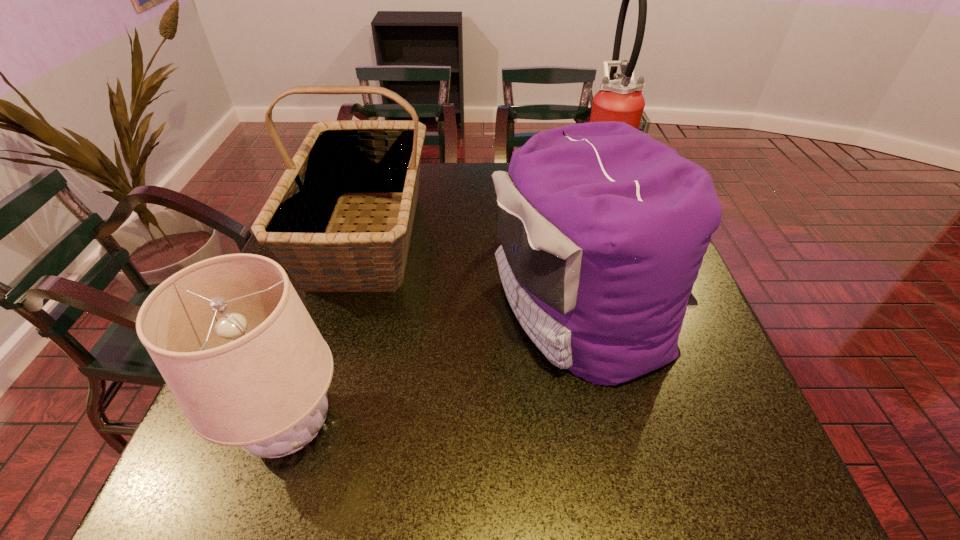
Where is `fire extinguisher`? This screenshot has height=540, width=960. fire extinguisher is located at coordinates (621, 100).

I want to click on basket, so click(338, 159).

Locate an element on the screen. backpack is located at coordinates (603, 229).

At what (x,y) coordinates should I click in order to perform the action: click on lampshade. Please return your answer as a coordinate pair (x, y). This screenshot has height=540, width=960. Looking at the image, I should click on (236, 346).

The height and width of the screenshot is (540, 960). Identify the location of free location located 0.220m at the nozzle of the fire extinguisher. (501, 192).

Where is `vacant space located 0.170m at the nozzle of the fire extinguisher`? Image resolution: width=960 pixels, height=540 pixels. vacant space located 0.170m at the nozzle of the fire extinguisher is located at coordinates (518, 192).

The image size is (960, 540). Identify the location of vacant space located 0.100m at the nozzle of the fire extinguisher. (541, 192).

Where is `free space located by the handle of the basket`? This screenshot has width=960, height=540. free space located by the handle of the basket is located at coordinates (299, 471).

Identify the location of free spot located 0.290m on the front pocket of the backpack. (360, 308).

Image resolution: width=960 pixels, height=540 pixels. Find the location of `free location located on the front pocket of the backpack`. free location located on the front pocket of the backpack is located at coordinates (404, 308).